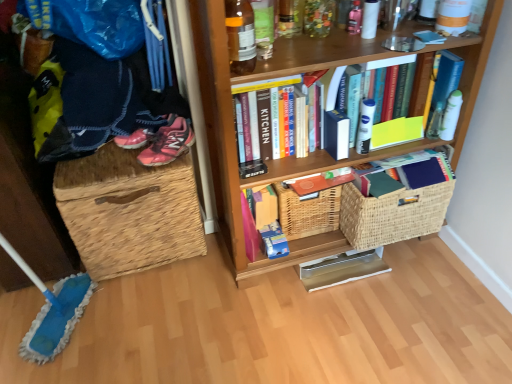
Locate an element on the screen. The image size is (512, 384). vacant area situated to the left side of pink mesh sneakers at left is located at coordinates (110, 166).